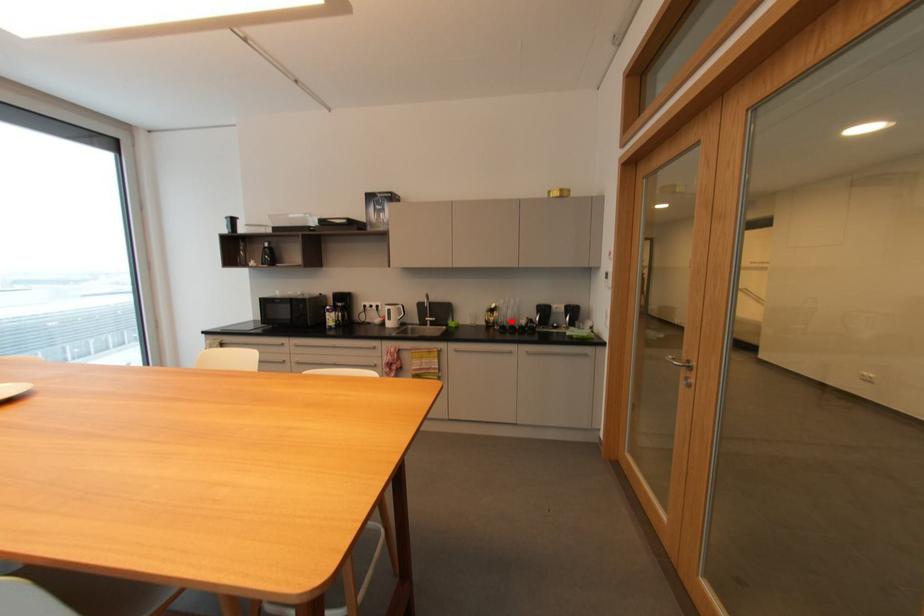
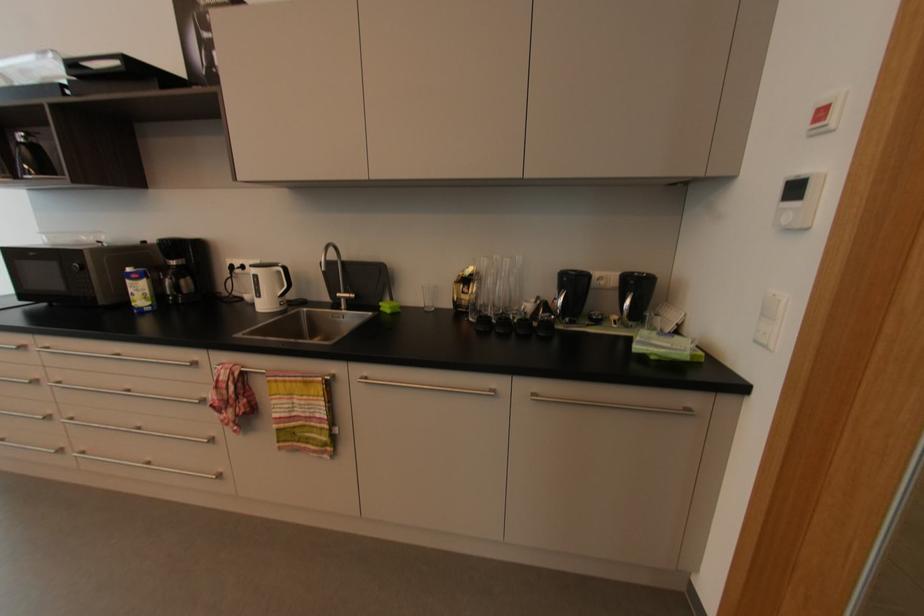
The point at the highlighted location is marked in the first image. Where is the corresponding point in the second image?

(500, 304)